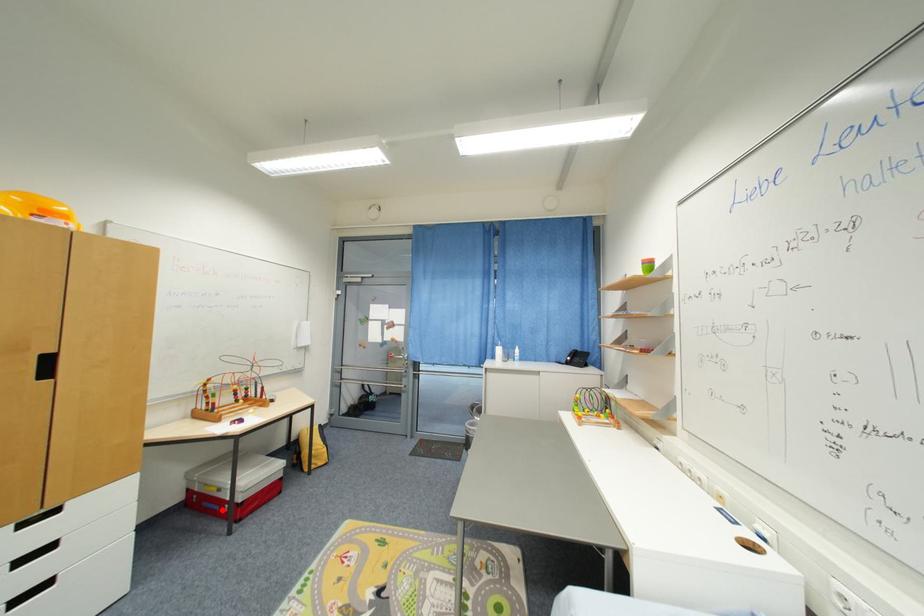
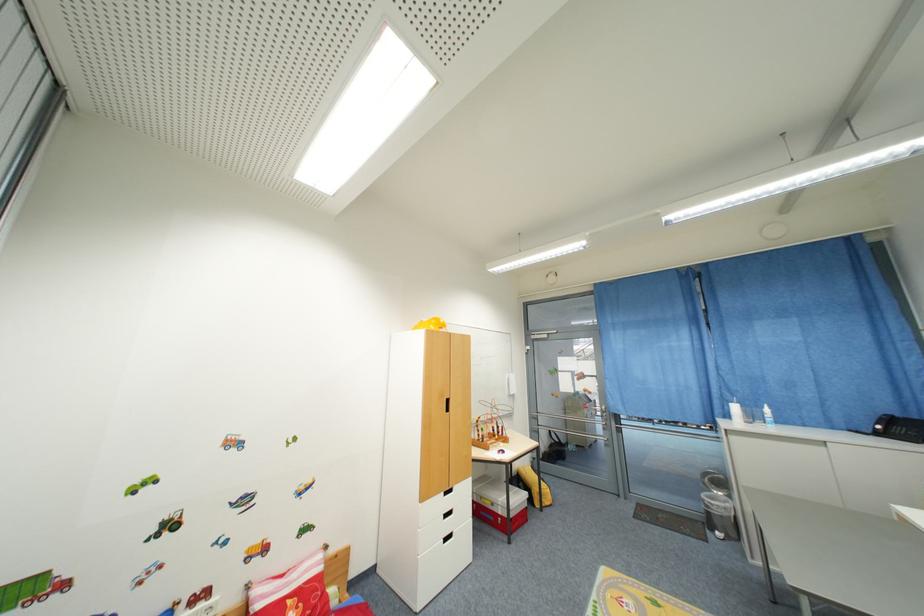
Locate, in the second image, the point that corresponds to the highlighted location in the first image.

(497, 521)